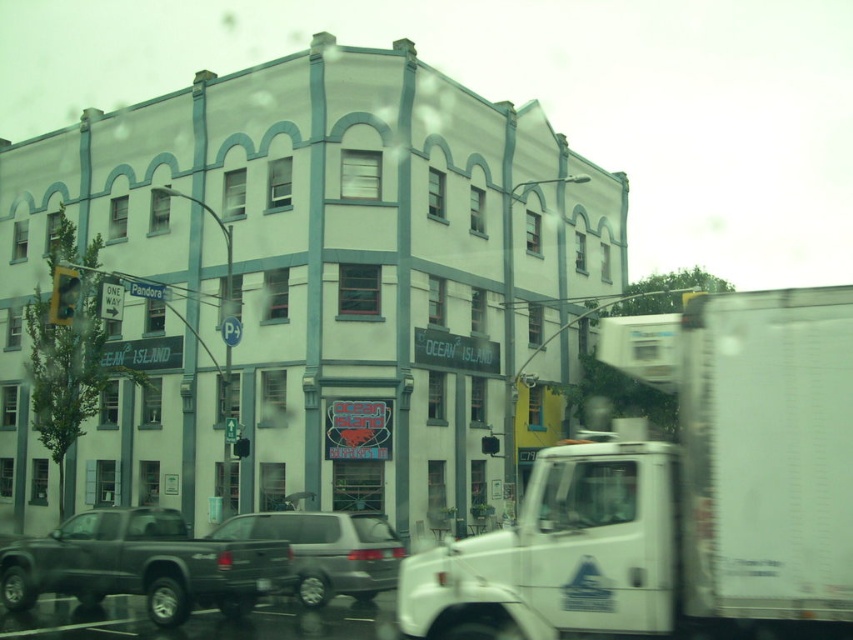
Question: Does matte black truck at lower left have a larger size compared to silver metallic suv at center?

Choices:
 (A) no
 (B) yes

Answer: (B)

Question: Does white matte truck at center come behind matte black truck at lower left?

Choices:
 (A) yes
 (B) no

Answer: (B)

Question: Which is nearer to the silver metallic suv at center?

Choices:
 (A) matte black truck at lower left
 (B) white matte truck at center

Answer: (A)

Question: Which object appears farthest from the camera in this image?

Choices:
 (A) matte black truck at lower left
 (B) silver metallic suv at center

Answer: (B)

Question: Which of these objects is positioned farthest from the silver metallic suv at center?

Choices:
 (A) matte black truck at lower left
 (B) white matte truck at center

Answer: (B)

Question: Does matte black truck at lower left appear on the left side of silver metallic suv at center?

Choices:
 (A) yes
 (B) no

Answer: (A)